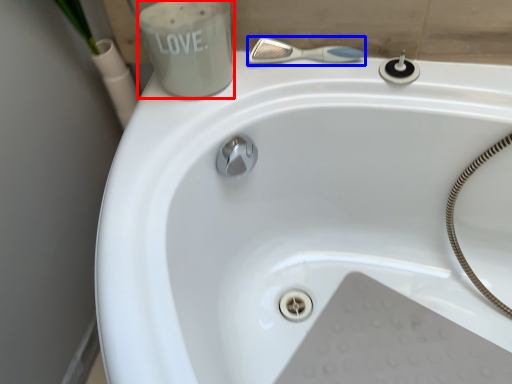
Question: Which point is further to the camera, liquid (highlighted by a red box) or shower (highlighted by a blue box)?

Choices:
 (A) liquid
 (B) shower

Answer: (B)